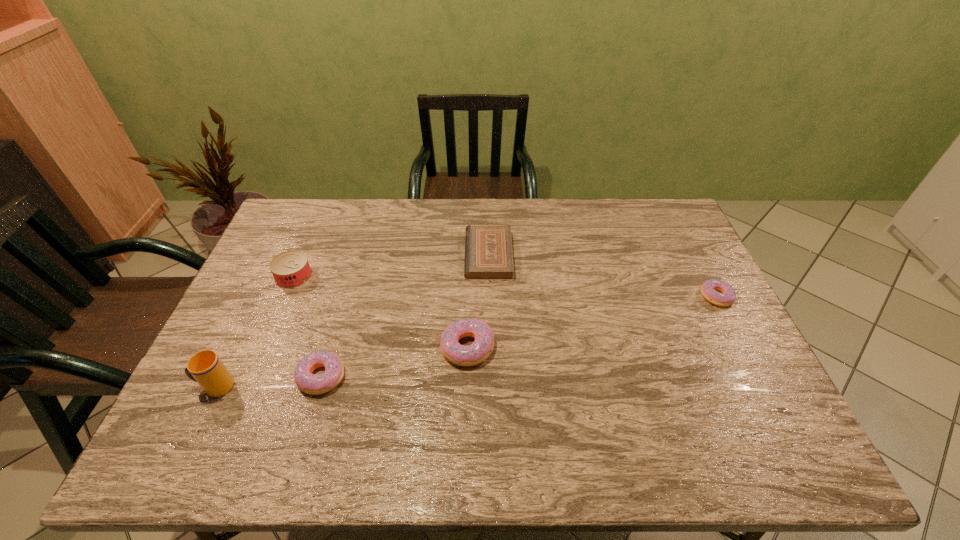
This screenshot has width=960, height=540. Identify the location of the closest doughnut to the can. [314, 384].

Select which doughnut is the second closest to the fourth tallest object. Please provide its 2D coordinates. Your answer should be formatted as a tuple, i.e. [(x, y)], where the tuple contains the x and y coordinates of a point satisfying the conditions above.

[(728, 296)]

You are a GUI agent. You are given a task and a screenshot of the screen. Output one action in this format:
    pyautogui.click(x=<x>, y=<y>)
    Task: Click on the vacant space that satisfies the following two spatial constraints: 1. on the back side of the rightmost object; 2. on the spine side of the Bible
    
    Given the screenshot: What is the action you would take?
    pyautogui.click(x=695, y=255)

You are a GUI agent. You are given a task and a screenshot of the screen. Output one action in this format:
    pyautogui.click(x=<x>, y=<y>)
    Task: Click on the free location that satisfies the following two spatial constraints: 1. on the side of the tallest object with the handle; 2. on the right side of the leftmost doughnut
    The height and width of the screenshot is (540, 960).
    Given the screenshot: What is the action you would take?
    (220, 376)

The width and height of the screenshot is (960, 540). I want to click on vacant position in the image that satisfies the following two spatial constraints: 1. on the side of the tallest doughnut with the handle; 2. on the left side of the cup, so click(x=234, y=347).

You are a GUI agent. You are given a task and a screenshot of the screen. Output one action in this format:
    pyautogui.click(x=<x>, y=<y>)
    Task: Click on the blank area in the image that satisfies the following two spatial constraints: 1. on the spine side of the Bible; 2. on the back side of the rightmost object
    This screenshot has height=540, width=960.
    Given the screenshot: What is the action you would take?
    pyautogui.click(x=490, y=296)

You are a GUI agent. You are given a task and a screenshot of the screen. Output one action in this format:
    pyautogui.click(x=<x>, y=<y>)
    Task: Click on the free spot that satisfies the following two spatial constraints: 1. on the spine side of the rightmost doughnut; 2. on the right side of the Bible
    The height and width of the screenshot is (540, 960).
    Given the screenshot: What is the action you would take?
    pyautogui.click(x=490, y=296)

At what (x,y) coordinates should I click in order to perform the action: click on free location that satisfies the following two spatial constraints: 1. on the side of the farthest doughnut with the handle; 2. on the right side of the tallest object. Please return your answer as a coordinate pair (x, y). Looking at the image, I should click on (258, 296).

Where is `vacant space that satisfies the following two spatial constraints: 1. on the side of the farthest doughnut with the handle; 2. on the right side of the tallest object`? The width and height of the screenshot is (960, 540). vacant space that satisfies the following two spatial constraints: 1. on the side of the farthest doughnut with the handle; 2. on the right side of the tallest object is located at coordinates (258, 296).

Find the location of a particular element. free spot that satisfies the following two spatial constraints: 1. on the back side of the shortest doughnut; 2. on the left side of the tallest doughnut is located at coordinates (468, 296).